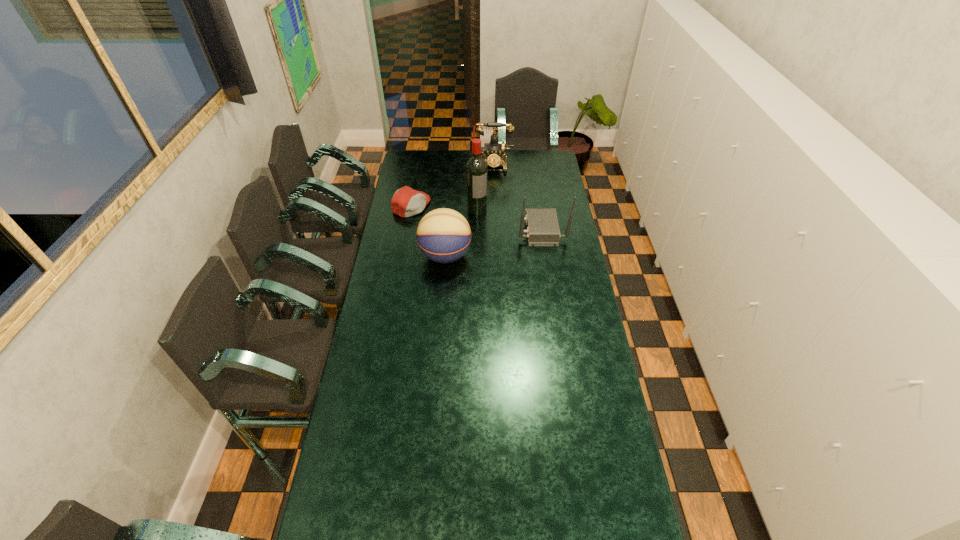
Locate an element on the screen. free space located on the front of the telephone, featuring the rotary dial is located at coordinates (492, 204).

You are a GUI agent. You are given a task and a screenshot of the screen. Output one action in this format:
    pyautogui.click(x=<x>, y=<y>)
    Task: Click on the free location located 0.180m on the front of the telephone, featuring the rotary dial
    Image resolution: width=960 pixels, height=540 pixels.
    Given the screenshot: What is the action you would take?
    pyautogui.click(x=492, y=192)

Where is `vacant space located on the front-facing side of the cap`? vacant space located on the front-facing side of the cap is located at coordinates (446, 221).

Identify the location of vacant space situated 0.100m on the front-facing side of the cap. The image size is (960, 540). (442, 219).

Where is `vacant space located 0.150m on the front-facing side of the cap`? The width and height of the screenshot is (960, 540). vacant space located 0.150m on the front-facing side of the cap is located at coordinates (449, 222).

I want to click on free space located 0.080m on the label of the wine bottle, so (487, 224).

Where is `vacant area located 0.210m on the label of the wine bottle`? vacant area located 0.210m on the label of the wine bottle is located at coordinates (497, 240).

Image resolution: width=960 pixels, height=540 pixels. Identify the location of vacant space situated on the label of the wine bottle. [x=492, y=232].

Identify the location of object present at the far edge. (493, 150).

I want to click on object located in the left edge section of the desktop, so click(x=406, y=202).